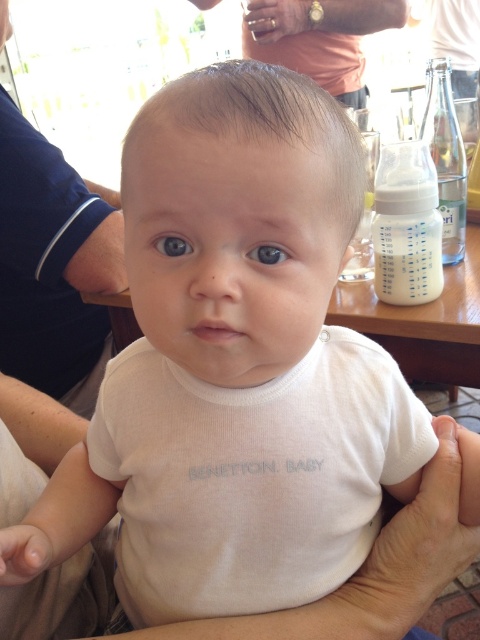
Question: Is white plastic baby bottle at upper right positioned behind clear glass bottle at upper right?

Choices:
 (A) no
 (B) yes

Answer: (A)

Question: Is wooden table at center smaller than white plastic baby bottle at upper right?

Choices:
 (A) yes
 (B) no

Answer: (B)

Question: Does wooden table at center appear on the left side of blue glossy eye at center?

Choices:
 (A) no
 (B) yes

Answer: (A)

Question: Which object is closer to the camera taking this photo?

Choices:
 (A) blue glossy eye at center
 (B) brown glossy eye at center
 (C) light brown smooth hair at center

Answer: (C)

Question: Among these points, which one is farthest from the camera?

Choices:
 (A) (177, 237)
 (B) (408, 205)
 (C) (302, 54)
 (D) (448, 138)

Answer: (C)

Question: Which point is farther from the camera taking this photo?

Choices:
 (A) (250, 252)
 (B) (448, 61)

Answer: (B)